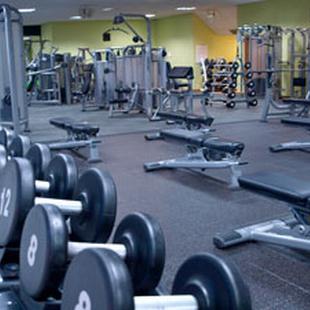
Locate an element on the screen. benches is located at coordinates (217, 141), (79, 124), (180, 114), (294, 99), (294, 119).